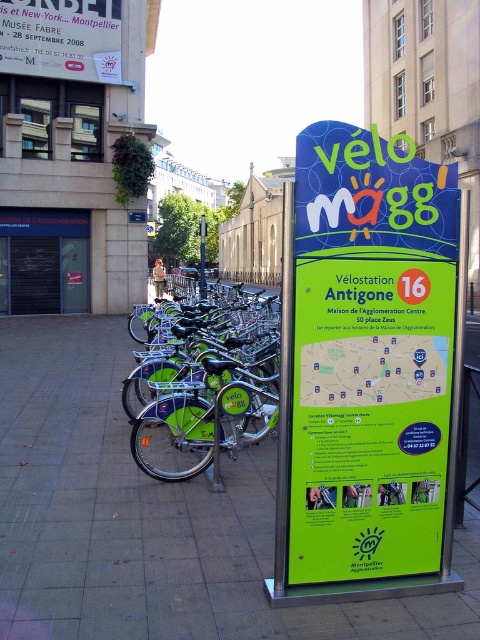
Question: Can you confirm if green metal pavement at center is positioned above green plastic sign at center?

Choices:
 (A) yes
 (B) no

Answer: (B)

Question: Does green metal pavement at center lie in front of green matte bicycle at center?

Choices:
 (A) yes
 (B) no

Answer: (A)

Question: Can you confirm if green plastic sign at center is positioned to the left of green matte bicycle at center?

Choices:
 (A) no
 (B) yes

Answer: (A)

Question: Among these objects, which one is nearest to the camera?

Choices:
 (A) green metal pavement at center
 (B) metallic gray bus stop at left

Answer: (A)

Question: Which of the following is the closest to the observer?

Choices:
 (A) green metal pavement at center
 (B) green plastic sign at center
 (C) metallic gray bus stop at left

Answer: (A)

Question: Which object is the closest to the green matte bicycle at center?

Choices:
 (A) green plastic sign at center
 (B) green metal pavement at center

Answer: (B)